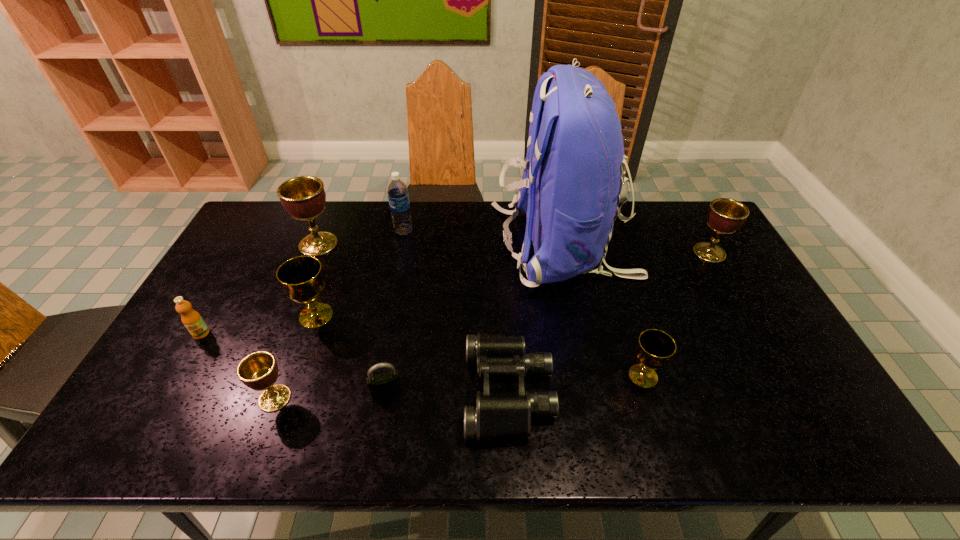
Where is `the smaller gold chalice`? Image resolution: width=960 pixels, height=540 pixels. the smaller gold chalice is located at coordinates (655, 348).

What are the coordinates of `the nearest golden chalice` in the screenshot? It's located at (259, 371).

Find the location of a particular element. This screenshot has height=540, width=960. black padlock is located at coordinates (382, 385).

This screenshot has width=960, height=540. Find the location of `black binoculars`. black binoculars is located at coordinates (499, 415).

At what (x,y) coordinates should I click in order to perform the action: click on free space located 0.130m on the back of the tallest object. Please return your answer as a coordinate pair (x, y). This screenshot has width=960, height=540. Looking at the image, I should click on (454, 245).

The height and width of the screenshot is (540, 960). What are the coordinates of `free space located 0.210m on the back of the tallest object` in the screenshot? It's located at (430, 245).

Locate an element on the screen. The height and width of the screenshot is (540, 960). free space located on the back of the tallest object is located at coordinates (451, 245).

I want to click on vacant space located on the back of the water bottle, so click(x=409, y=205).

You are a GUI agent. You are given a task and a screenshot of the screen. Output one action in this format:
    pyautogui.click(x=<x>, y=<y>)
    Task: Click on the vacant space located on the back of the tallest chalice
    
    Given the screenshot: What is the action you would take?
    pyautogui.click(x=327, y=221)

Where is `free location located on the front of the second biggest golden chalice`? This screenshot has height=540, width=960. free location located on the front of the second biggest golden chalice is located at coordinates (752, 326).